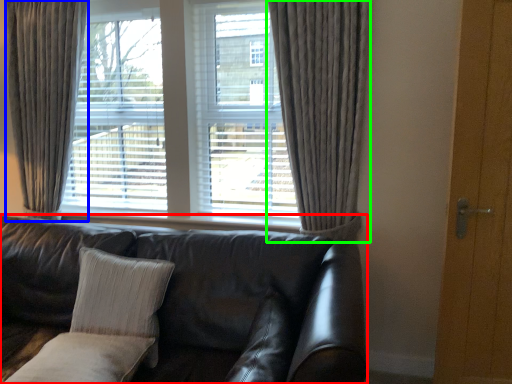
Question: Which object is the farthest from studio couch (highlighted by a red box)? Choose among these: curtain (highlighted by a blue box) or curtain (highlighted by a green box).

Choices:
 (A) curtain
 (B) curtain

Answer: (A)